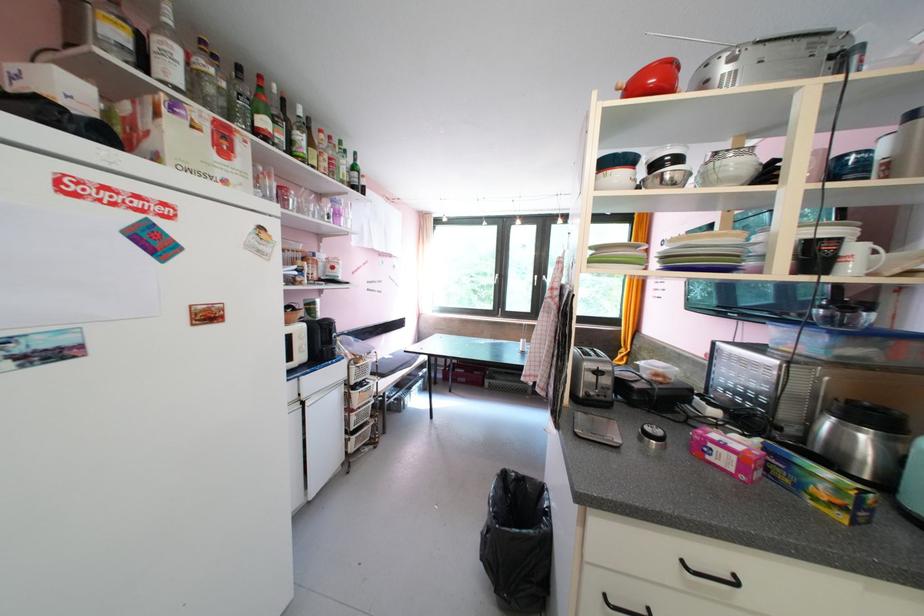
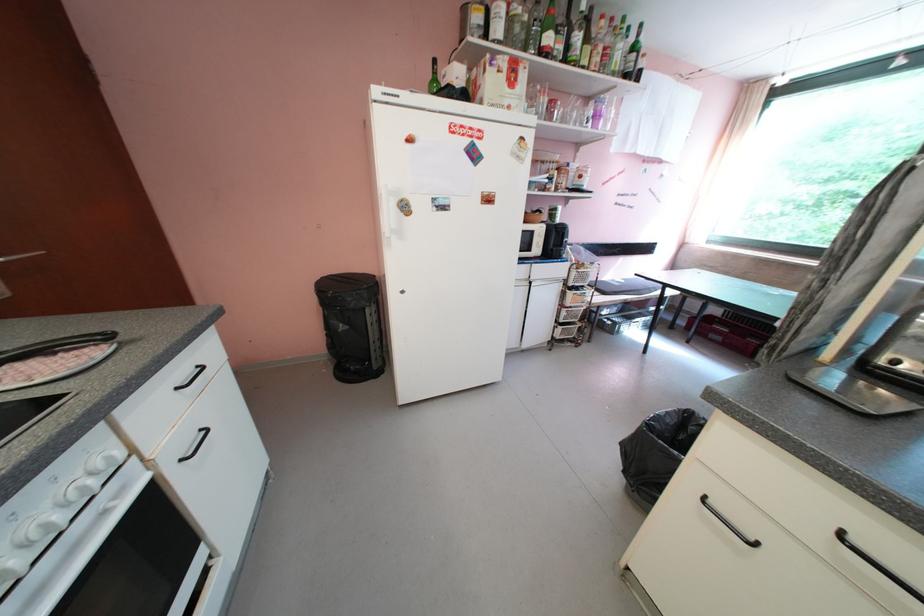
Where in the second image is the point corresponding to point 365,361 from the first image?

(588, 268)